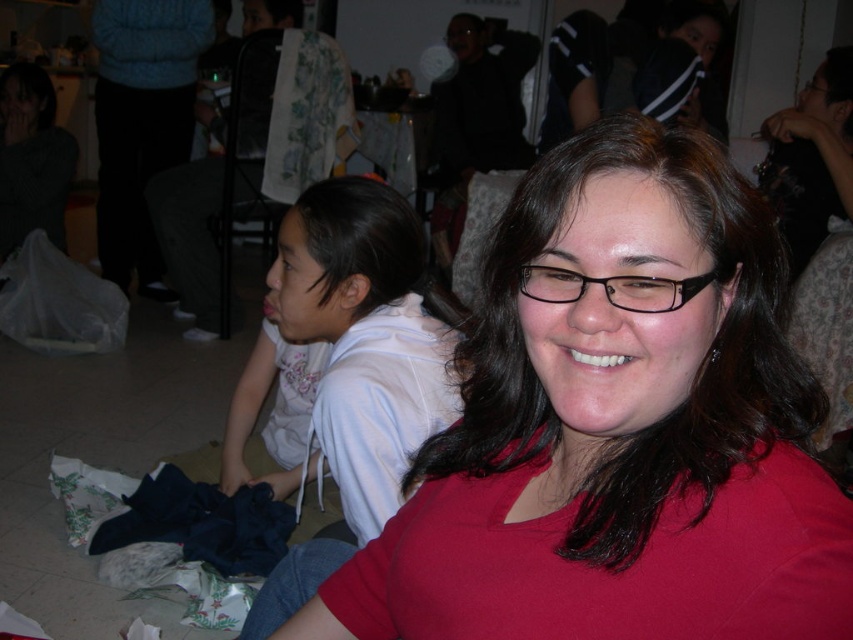
Who is lower down, matte red shirt at center or black plastic glasses at center?

matte red shirt at center is below.

Does matte red shirt at center come in front of black plastic glasses at center?

Yes, it is.

Between point (772, 426) and point (709, 282), which one is positioned in front?

Point (709, 282)

This screenshot has width=853, height=640. Identify the location of matte red shirt at center. (616, 432).

Who is higher up, matte red shirt at center or white cotton hoodie at lower left?

white cotton hoodie at lower left is higher up.

Between matte red shirt at center and white cotton hoodie at lower left, which one has less height?

matte red shirt at center

Who is more distant from viewer, (343, 586) or (308, 593)?

Point (308, 593)

Where is `matte red shirt at center`? matte red shirt at center is located at coordinates (616, 432).

Does white cotton hoodie at lower left have a smaller size compared to black plastic glasses at center?

No.

Does white cotton hoodie at lower left have a greater height compared to black plastic glasses at center?

Indeed, white cotton hoodie at lower left has a greater height compared to black plastic glasses at center.

Measure the distance between white cotton hoodie at lower left and camera.

white cotton hoodie at lower left is 32.82 inches from camera.

Locate an element on the screen. The image size is (853, 640). white cotton hoodie at lower left is located at coordinates (364, 337).